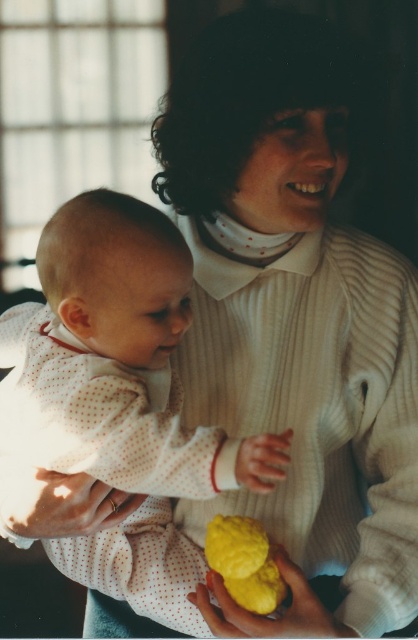
Question: Does white dotted fabric at center have a greater width compared to yellow matte cookie at lower center?

Choices:
 (A) yes
 (B) no

Answer: (A)

Question: From the image, what is the correct spatial relationship of white dotted fabric at center in relation to yellow matte cookie at lower center?

Choices:
 (A) above
 (B) below

Answer: (A)

Question: Observing the image, what is the correct spatial positioning of white dotted fabric at center in reference to yellow matte cookie at lower center?

Choices:
 (A) above
 (B) below

Answer: (A)

Question: Which point is farther from the camera taking this photo?

Choices:
 (A) (231, 561)
 (B) (196, 493)

Answer: (A)